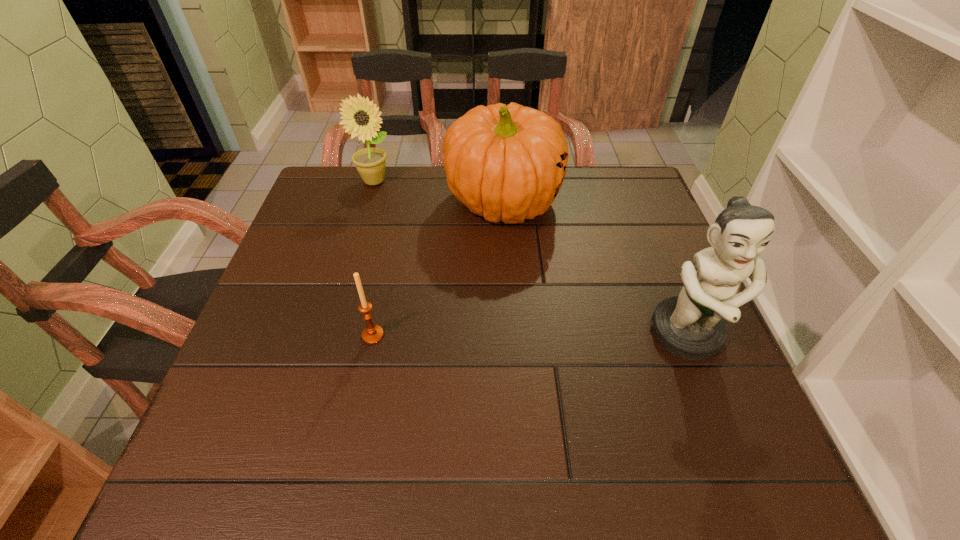
I want to click on free space on the desktop that is between the candle_holder and the figurine and is positioned on the surface of the second object from right to left, so click(576, 336).

Find the location of a particular element. This screenshot has width=960, height=540. free space on the desktop that is between the second object from left to right and the figurine and is positioned on the face of the leftmost object is located at coordinates (489, 335).